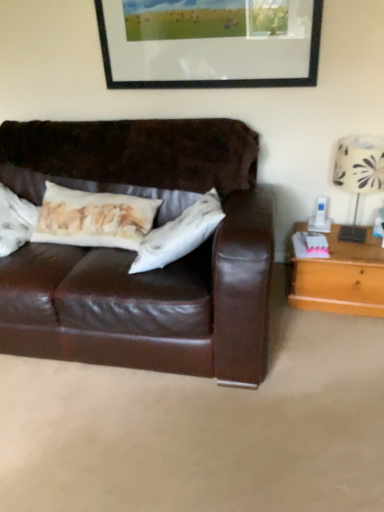
Question: Considering the relative sizes of black matte picture frame at upper center and white fabric lampshade at right in the image provided, is black matte picture frame at upper center thinner than white fabric lampshade at right?

Choices:
 (A) yes
 (B) no

Answer: (A)

Question: Considering the relative sizes of black matte picture frame at upper center and white fabric lampshade at right in the image provided, is black matte picture frame at upper center bigger than white fabric lampshade at right?

Choices:
 (A) yes
 (B) no

Answer: (B)

Question: Does black matte picture frame at upper center appear on the left side of white fabric lampshade at right?

Choices:
 (A) no
 (B) yes

Answer: (B)

Question: Is black matte picture frame at upper center in front of white fabric lampshade at right?

Choices:
 (A) yes
 (B) no

Answer: (B)

Question: From a real-world perspective, is black matte picture frame at upper center beneath white fabric lampshade at right?

Choices:
 (A) no
 (B) yes

Answer: (A)

Question: Would you say black matte picture frame at upper center is to the left or to the right of light brown wooden table at right in the picture?

Choices:
 (A) left
 (B) right

Answer: (A)

Question: From the image's perspective, is black matte picture frame at upper center above or below light brown wooden table at right?

Choices:
 (A) above
 (B) below

Answer: (A)

Question: From their relative heights in the image, would you say black matte picture frame at upper center is taller or shorter than light brown wooden table at right?

Choices:
 (A) short
 (B) tall

Answer: (B)

Question: Does point (296, 2) appear closer or farther from the camera than point (354, 266)?

Choices:
 (A) farther
 (B) closer

Answer: (B)

Question: From the image's perspective, relative to white fabric lampshade at right, is black matte picture frame at upper center above or below?

Choices:
 (A) above
 (B) below

Answer: (A)

Question: Is black matte picture frame at upper center inside the boundaries of white fabric lampshade at right, or outside?

Choices:
 (A) outside
 (B) inside

Answer: (A)

Question: Based on their positions, is black matte picture frame at upper center located to the left or right of white fabric lampshade at right?

Choices:
 (A) left
 (B) right

Answer: (A)

Question: From a real-world perspective, is black matte picture frame at upper center physically located above or below white fabric lampshade at right?

Choices:
 (A) below
 (B) above

Answer: (B)

Question: In terms of size, does white fabric lampshade at right appear bigger or smaller than black matte picture frame at upper center?

Choices:
 (A) small
 (B) big

Answer: (B)

Question: Is white fabric lampshade at right to the left or to the right of black matte picture frame at upper center in the image?

Choices:
 (A) left
 (B) right

Answer: (B)